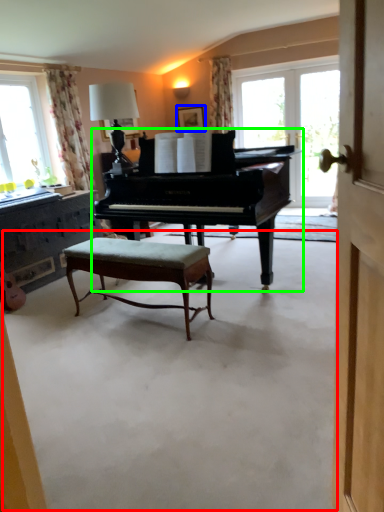
Question: Considering the real-world distances, which object is farthest from concrete (highlighted by a red box)? picture frame (highlighted by a blue box) or piano (highlighted by a green box)?

Choices:
 (A) picture frame
 (B) piano

Answer: (A)